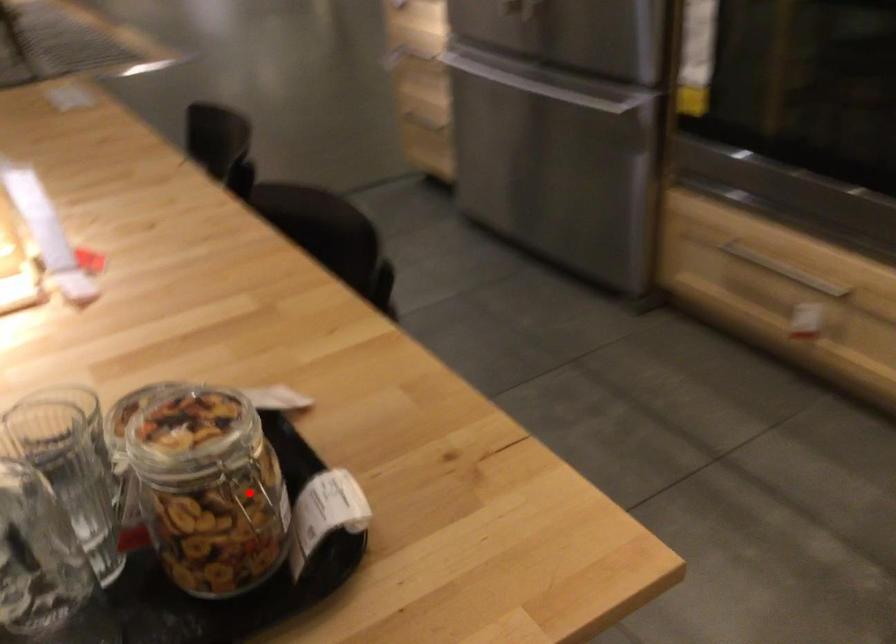
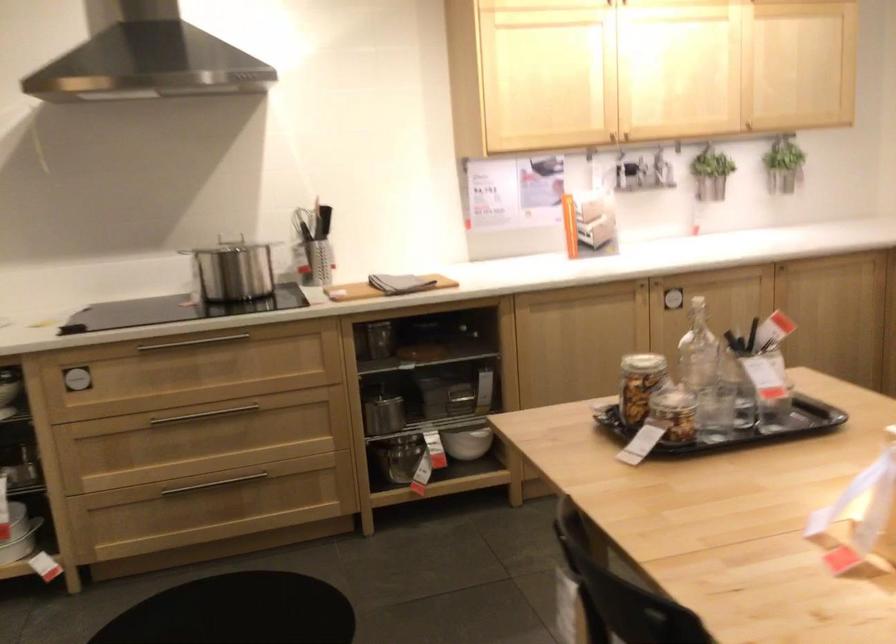
Question: I am providing you with two images of the same scene from different viewpoints. A red point is marked on the first image. At the location where the point appears in image 1, is it still visible in image 2?

Choices:
 (A) Yes
 (B) No

Answer: (B)